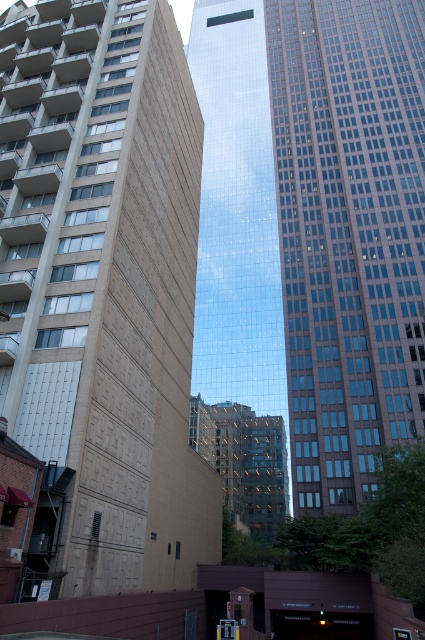
Looking at this image, you are standing in an urban area and want to take a photo of the brown textured building at center. If your camera can focus up to 20 meters, will you need to adjust your position to capture it clearly?

The brown textured building at center is 22.13 meters away from the viewer, which exceeds the camera focus limit of 20 meters. Therefore, you need to move closer to ensure clear focus.

You are an architect planning to install a large billboard between the brown textured building at center and the glassy reflective skyscraper at center. Which building should the billboard be closer to if you want it to be more visible from the street below?

The billboard should be placed closer to the glassy reflective skyscraper at center because it is wider than the brown textured building at center, making it more visible from the street below.